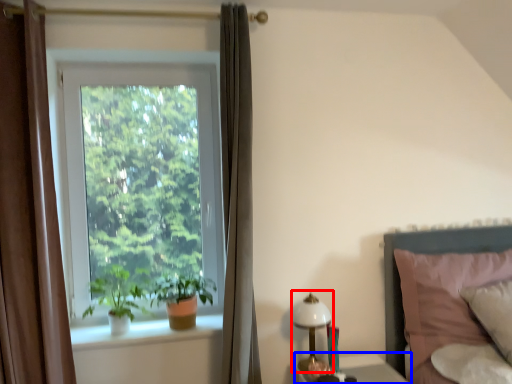
Question: Which of the following is the closest to the observer, bedside lamp (highlighted by a red box) or table (highlighted by a blue box)?

Choices:
 (A) bedside lamp
 (B) table

Answer: (B)